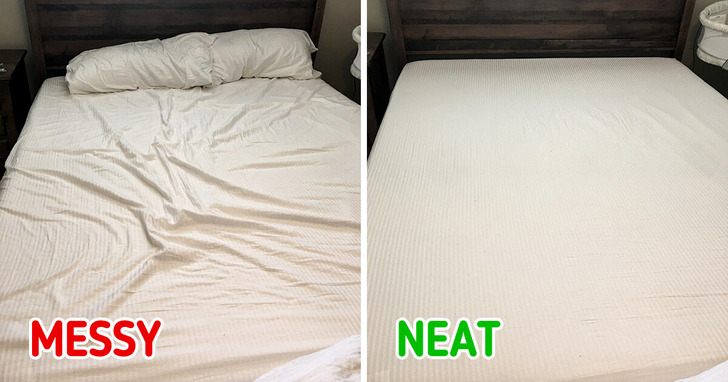
Where is `wrinkled sheets`? This screenshot has height=382, width=728. wrinkled sheets is located at coordinates (175, 202), (162, 240), (167, 176), (170, 131).